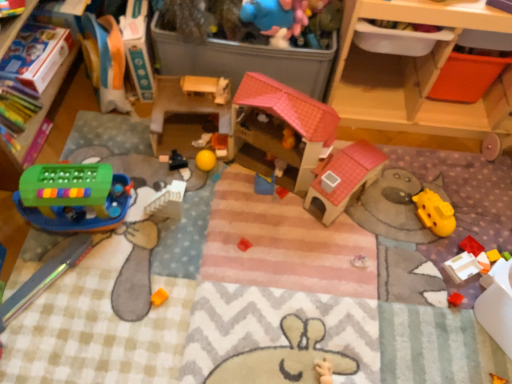
The image size is (512, 384). I want to click on free space between yellow rubber ball at center, which appears as the sixth toy when viewed from the left, and yellow plastic spoon at center, the 7th toy when ordered from left to right, so click(242, 171).